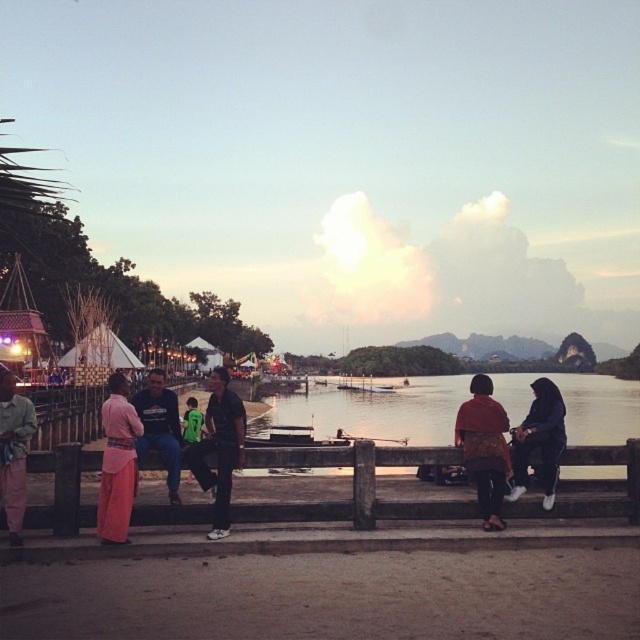
Question: Estimate the real-world distances between objects in this image. Which object is closer to the black matte jacket at center?

Choices:
 (A) dark blue fabric jacket at right
 (B) green jersey at center

Answer: (A)

Question: Which point appears closest to the camera in this image?

Choices:
 (A) (618, 438)
 (B) (3, 378)

Answer: (B)

Question: Considering the relative positions of pink fabric pants at lower left and matte green pants at lower left in the image provided, where is pink fabric pants at lower left located with respect to matte green pants at lower left?

Choices:
 (A) below
 (B) above

Answer: (A)

Question: Estimate the real-world distances between objects in this image. Which object is closer to the green jersey at center?

Choices:
 (A) matte green pants at lower left
 (B) dark blue jeans at center
 (C) smooth concrete river at center

Answer: (B)

Question: Does matte brown shirt at center have a smaller size compared to green jersey at center?

Choices:
 (A) yes
 (B) no

Answer: (A)

Question: Is dark blue jeans at center positioned behind green jersey at center?

Choices:
 (A) no
 (B) yes

Answer: (A)